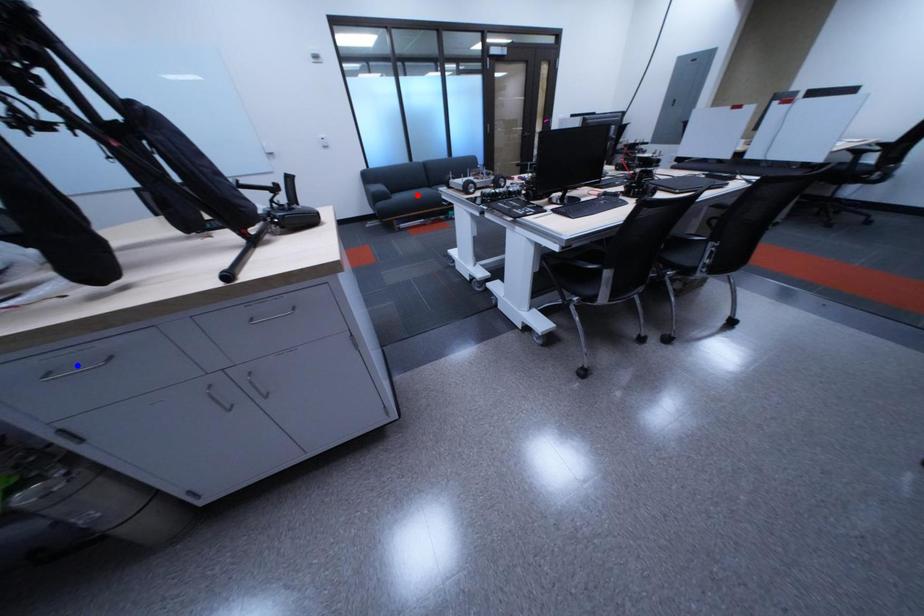
Question: Which of the two points in the image is closer to the camera?

Choices:
 (A) Blue point is closer.
 (B) Red point is closer.

Answer: (A)